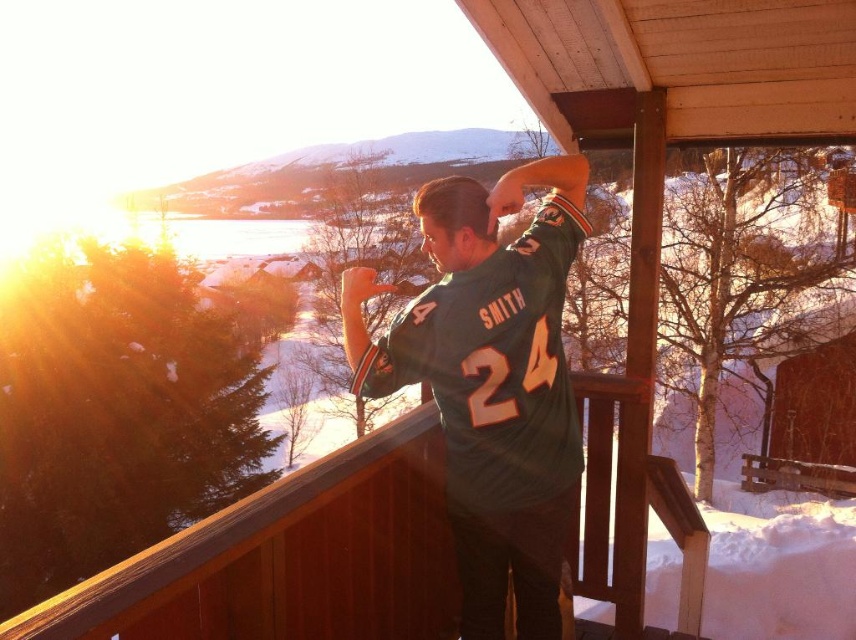
Question: Can you confirm if brown wooden porch at center is wider than green jersey at center?

Choices:
 (A) yes
 (B) no

Answer: (A)

Question: Which point is farther to the camera?

Choices:
 (A) (610, 394)
 (B) (465, 259)

Answer: (A)

Question: Which point is farther from the camera taking this photo?

Choices:
 (A) (260, 504)
 (B) (492, 552)

Answer: (B)

Question: From the image, what is the correct spatial relationship of brown wooden porch at center in relation to green jersey at center?

Choices:
 (A) above
 (B) below

Answer: (B)

Question: Can you confirm if brown wooden porch at center is positioned above green jersey at center?

Choices:
 (A) yes
 (B) no

Answer: (B)